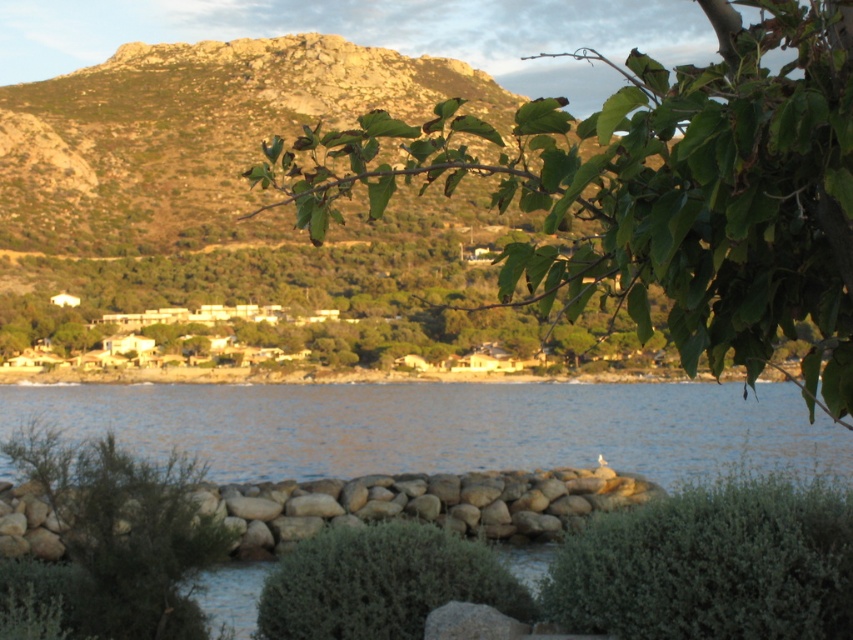
Question: Is the position of green leafy bush at lower left less distant than that of green fuzzy bush at center?

Choices:
 (A) yes
 (B) no

Answer: (B)

Question: Does green leafy branch at upper center appear on the right side of green leafy bush at lower center?

Choices:
 (A) yes
 (B) no

Answer: (A)

Question: Which point is closer to the camera taking this photo?

Choices:
 (A) (747, 120)
 (B) (384, 580)
 (C) (154, 545)
 (D) (821, 625)

Answer: (A)

Question: Which point appears closest to the camera in this image?

Choices:
 (A) (26, 429)
 (B) (381, 532)

Answer: (B)

Question: Is green leafy branch at upper center to the left of green fuzzy bush at center from the viewer's perspective?

Choices:
 (A) no
 (B) yes

Answer: (A)

Question: Which of the following is the closest to the observer?

Choices:
 (A) 741,552
 (B) 517,284

Answer: (B)